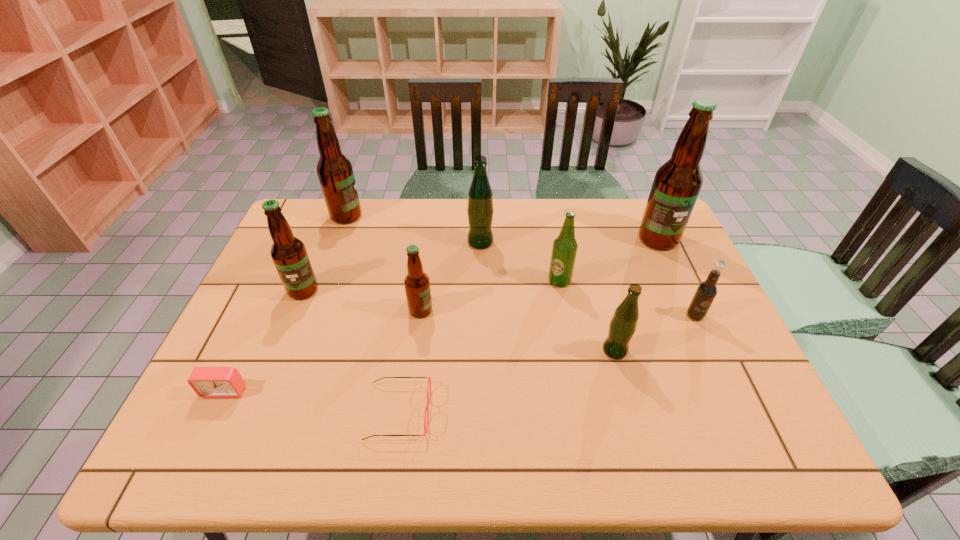
You are a GUI agent. You are given a task and a screenshot of the screen. Output one action in this format:
    pyautogui.click(x=<x>, y=<y>)
    Task: Click on the empty space between the tallest object and the third farthest brown beer bottle
    This screenshot has height=540, width=960.
    Given the screenshot: What is the action you would take?
    pyautogui.click(x=481, y=265)

Locate an element on the screen. vacant space that is in between the red spectacles and the second green beer bottle from left to right is located at coordinates (479, 347).

Find the location of `blank region between the second nearest beer bottle and the red spectacles`. blank region between the second nearest beer bottle and the red spectacles is located at coordinates (410, 361).

The height and width of the screenshot is (540, 960). I want to click on blank region between the farthest beer bottle and the biggest brown beer bottle, so click(502, 227).

Locate an element on the screen. This screenshot has height=540, width=960. vacant point located between the alarm clock and the fifth beer bottle from right to left is located at coordinates (323, 350).

Find the location of a particular element. This screenshot has width=960, height=540. free space between the second nearest brown beer bottle and the spectacles is located at coordinates (351, 351).

Find the location of a particular element. The width and height of the screenshot is (960, 540). free spot between the red spectacles and the rightmost green beer bottle is located at coordinates (507, 381).

I want to click on vacant area that lies between the fourth beer bottle from left to right and the smallest brown beer bottle, so click(450, 276).

Identify the location of vacant area that lies between the red alarm clock and the second nearest beer bottle. (323, 350).

Locate an element on the screen. free space between the second green beer bottle from left to right and the rightmost green beer bottle is located at coordinates [587, 316].